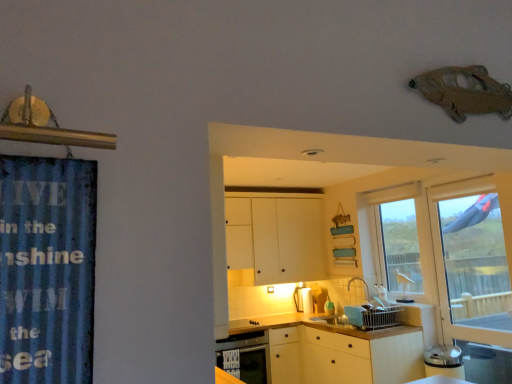
Where is `clear glass window at center`? The image size is (512, 384). clear glass window at center is located at coordinates (401, 247).

This screenshot has width=512, height=384. Describe the element at coordinates (401, 247) in the screenshot. I see `clear glass window at center` at that location.

Measure the distance between point (319, 307) and camera.

4.83 meters.

This screenshot has width=512, height=384. What do you see at coordinates (303, 299) in the screenshot?
I see `white glossy paper towel dispenser at center, the 1th appliance positioned from the back` at bounding box center [303, 299].

Measure the distance between blue corrugated metal at left and camera.

blue corrugated metal at left and camera are 36.39 inches apart from each other.

Where is `white matte counter top at lower center`? white matte counter top at lower center is located at coordinates (339, 350).

Is white glossy paper towel dispenser at center, placed as the third appliance when sorted from front to back, surrounding matte white dishwasher at lower center?

No.

This screenshot has height=384, width=512. In order to click on appliance that is the 2nd object located behind the matte white dishwasher at lower center in this screenshot , I will do `click(303, 299)`.

How distant is white glossy paper towel dispenser at center, the 1th appliance positioned from the back, from matte white dishwasher at lower center?

They are 3.56 feet apart.

This screenshot has width=512, height=384. What are the coordinates of `the 1st appliance behind the clear glass window at center` in the screenshot? It's located at (319, 298).

Consider the image. Considering the sizes of matte white toaster at lower center, which is the second appliance from back to front, and clear glass window at center in the image, is matte white toaster at lower center, which is the second appliance from back to front, wider or thinner than clear glass window at center?

In the image, matte white toaster at lower center, which is the second appliance from back to front, appears to be more narrow than clear glass window at center.

How much distance is there between matte white toaster at lower center, which is the second appliance from back to front, and clear glass window at center?

matte white toaster at lower center, which is the second appliance from back to front, and clear glass window at center are 3.43 feet apart.

From a real-world perspective, who is located higher, matte white toaster at lower center, which is the second appliance from back to front, or clear glass window at center?

From a 3D spatial view, clear glass window at center is above.

Is matte white dishwasher at lower center facing away from white glossy paper towel dispenser at center, acting as the 3th appliance starting from the right?

No.

At what (x,y) coordinates should I click in order to perform the action: click on dish washer that appears in front of the white glossy paper towel dispenser at center, placed as the third appliance when sorted from front to back. Please return your answer as a coordinate pair (x, y). Looking at the image, I should click on (246, 356).

Does matte white dishwasher at lower center have a smaller size compared to white glossy paper towel dispenser at center, acting as the 3th appliance starting from the right?

No.

Who is shorter, matte white dishwasher at lower center or clear glass window at center?

matte white dishwasher at lower center.

Which is farther, (265,349) or (384,217)?

The point (384,217) is farther.

Who is more distant, matte white dishwasher at lower center or clear glass window at center?

clear glass window at center is more distant.

Considering the relative sizes of matte white dishwasher at lower center and white matte counter top at lower center in the image provided, is matte white dishwasher at lower center smaller than white matte counter top at lower center?

Indeed, matte white dishwasher at lower center has a smaller size compared to white matte counter top at lower center.

Is matte white dishwasher at lower center facing towards white matte counter top at lower center?

No, matte white dishwasher at lower center does not turn towards white matte counter top at lower center.

Is the depth of matte white dishwasher at lower center greater than that of white matte counter top at lower center?

That is True.

What's the angular difference between matte white dishwasher at lower center and white matte counter top at lower center's facing directions?

matte white dishwasher at lower center and white matte counter top at lower center are facing 89.3 degrees away from each other.

How many degrees apart are the facing directions of white matte cabinet at center and transparent glass door at right?

The angular difference between white matte cabinet at center and transparent glass door at right is 89.2 degrees.

In the scene shown: From a real-world perspective, which is physically below, white matte cabinet at center or transparent glass door at right?

transparent glass door at right, from a real-world perspective.

Would you say transparent glass door at right is part of white matte cabinet at center's contents?

Definitely not — transparent glass door at right is not inside white matte cabinet at center.

Is matte white toaster at lower center, which is the second appliance from back to front, to the right of white matte cabinet at center from the viewer's perspective?

Yes.

Who is shorter, matte white toaster at lower center, which is the second appliance from back to front, or white matte cabinet at center?

With less height is matte white toaster at lower center, which is the second appliance from back to front.

From the image's perspective, who appears lower, matte white toaster at lower center, which is the second appliance in left-to-right order, or white matte cabinet at center?

matte white toaster at lower center, which is the second appliance in left-to-right order, appears lower in the image.

The width and height of the screenshot is (512, 384). Identify the location of dish washer that is in front of the white glossy paper towel dispenser at center, placed as the third appliance when sorted from front to back. (246, 356).

The width and height of the screenshot is (512, 384). In order to click on window above the matte white toaster at lower center, which is the 2th appliance from front to back (from the image's perspective) in this screenshot , I will do [401, 247].

When comparing their distances from matte white toaster at lower center, marked as the second appliance in a right-to-left arrangement, does white glossy paper towel dispenser at center, placed as the third appliance when sorted from front to back, or matte white dishwasher at lower center seem further?

matte white dishwasher at lower center.

Consider the image. Based on their spatial positions, is clear glass window at center or matte white dishwasher at lower center further from matte white toaster at lower center, marked as the second appliance in a right-to-left arrangement?

Based on the image, matte white dishwasher at lower center appears to be further to matte white toaster at lower center, marked as the second appliance in a right-to-left arrangement.

Estimate the real-world distances between objects in this image. Which object is closer to white matte counter top at lower center, transparent glass door at right or blue corrugated metal at left?

Among the two, transparent glass door at right is located nearer to white matte counter top at lower center.

Which object lies nearer to the anchor point white matte cabinet at center, clear glass window at center or blue corrugated metal at left?

clear glass window at center is positioned closer to the anchor white matte cabinet at center.

When comparing their distances from white matte cabinet at center, does matte white dishwasher at lower center or transparent glass door at right seem further?

transparent glass door at right.

Based on their spatial positions, is blue corrugated metal at left or white plastic dish rack at lower center, the first appliance from the right, further from white matte counter top at lower center?

blue corrugated metal at left.

Considering their positions, is matte white dishwasher at lower center positioned further to white plastic dish rack at lower center, the third appliance viewed from the left, than matte white toaster at lower center, which is the second appliance from back to front?

Based on the image, matte white toaster at lower center, which is the second appliance from back to front, appears to be further to white plastic dish rack at lower center, the third appliance viewed from the left.

Based on their spatial positions, is matte white toaster at lower center, which is the 2th appliance from front to back, or white matte cabinet at center further from white plastic dish rack at lower center, which is the 1th appliance from front to back?

The object further to white plastic dish rack at lower center, which is the 1th appliance from front to back, is white matte cabinet at center.

Where is `counter top between matte white dishwasher at lower center and clear glass window at center in the horizontal direction`? The width and height of the screenshot is (512, 384). counter top between matte white dishwasher at lower center and clear glass window at center in the horizontal direction is located at coordinates (339, 350).

In order to click on appliance situated between white matte counter top at lower center and transparent glass door at right from left to right in this screenshot , I will do `click(373, 316)`.

You are a GUI agent. You are given a task and a screenshot of the screen. Output one action in this format:
    pyautogui.click(x=<x>, y=<y>)
    Task: Click on the glass door between blue corrugated metal at left and clear glass window at center along the z-axis
    The height and width of the screenshot is (384, 512).
    Given the screenshot: What is the action you would take?
    pyautogui.click(x=472, y=266)

Where is `cabinetry between matte white dishwasher at lower center and transparent glass door at right`? cabinetry between matte white dishwasher at lower center and transparent glass door at right is located at coordinates (x=276, y=238).